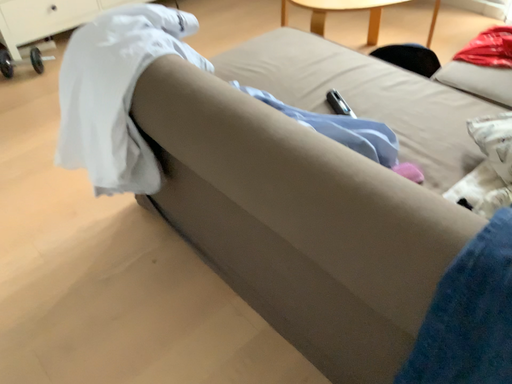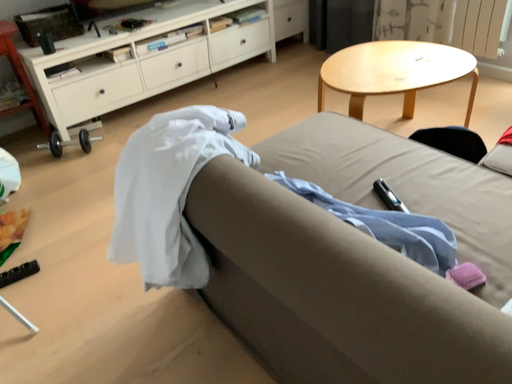
Question: How did the camera likely rotate when shooting the video?

Choices:
 (A) rotated downward
 (B) rotated upward

Answer: (B)